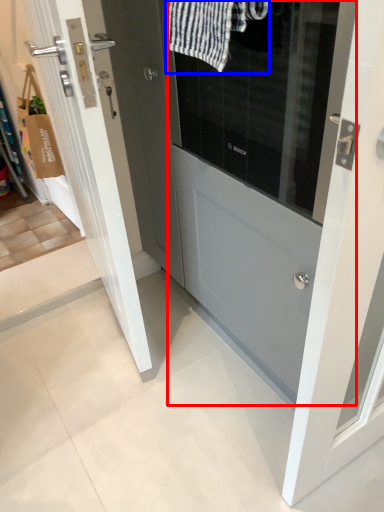
Question: Among these objects, which one is farthest to the camera, door (highlighted by a red box) or bath towel (highlighted by a blue box)?

Choices:
 (A) door
 (B) bath towel

Answer: (B)